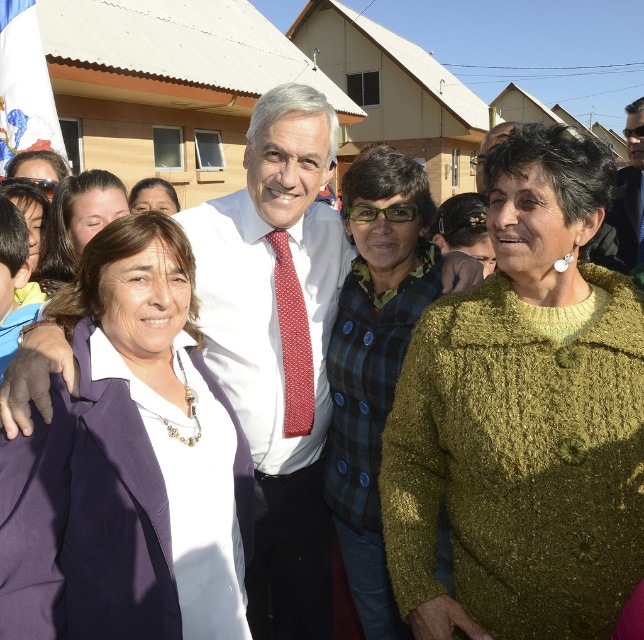
From the picture: Is purple fabric jacket at left bigger than matte green sweater at center?

Indeed, purple fabric jacket at left has a larger size compared to matte green sweater at center.

At what (x,y) coordinates should I click in order to perform the action: click on purple fabric jacket at left. Please return your answer as a coordinate pair (x, y). Image resolution: width=644 pixels, height=640 pixels. Looking at the image, I should click on (128, 465).

Is point (62, 438) positioned in front of point (478, 216)?

Yes.

Where is `purple fabric jacket at left`? The height and width of the screenshot is (640, 644). purple fabric jacket at left is located at coordinates (128, 465).

Can you confirm if green textured sweater at center is taller than matte black hair at upper left?

Yes.

Is green textured sweater at center to the right of matte black hair at upper left from the viewer's perspective?

Yes, green textured sweater at center is to the right of matte black hair at upper left.

Measure the distance between green textured sweater at center and camera.

11.41 feet

At what (x,y) coordinates should I click in order to perform the action: click on green textured sweater at center. Please return your answer as a coordinate pair (x, y). The width and height of the screenshot is (644, 640). Looking at the image, I should click on [x=374, y=358].

Is knitted olive-green sweater at center smaller than green textured sweater at center?

Yes, knitted olive-green sweater at center is smaller than green textured sweater at center.

Is knitted olive-green sweater at center taller than green textured sweater at center?

No.

Locate an element on the screen. The height and width of the screenshot is (640, 644). knitted olive-green sweater at center is located at coordinates (524, 417).

Find the location of a particular element. The height and width of the screenshot is (640, 644). knitted olive-green sweater at center is located at coordinates (524, 417).